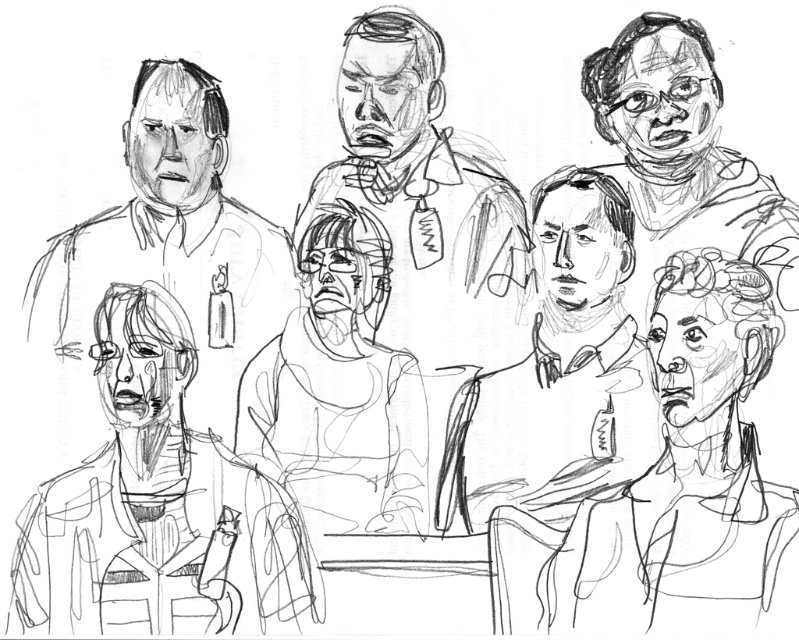
Between smooth paper man at center and matte black shirt at upper left, which one is positioned lower?

matte black shirt at upper left is below.

Which is behind, point (442, 298) or point (150, 208)?

The point (442, 298) is behind.

The height and width of the screenshot is (640, 799). I want to click on smooth paper man at center, so click(x=426, y=198).

Measure the distance between smooth paper man at center and smooth skin face at upper right.

They are 40.10 centimeters apart.

Is smooth paper man at center positioned at the back of smooth skin face at upper right?

Yes, it is.

At what (x,y) coordinates should I click in order to perform the action: click on smooth paper man at center. Please return your answer as a coordinate pair (x, y). The height and width of the screenshot is (640, 799). Looking at the image, I should click on (426, 198).

Is matte black shirt at upper left further to camera compared to smooth skin face at upper right?

Yes, matte black shirt at upper left is behind smooth skin face at upper right.

Which is in front, point (130, 109) or point (778, 289)?

Positioned in front is point (778, 289).

This screenshot has height=640, width=799. What do you see at coordinates (173, 243) in the screenshot?
I see `matte black shirt at upper left` at bounding box center [173, 243].

You are a GUI agent. You are given a task and a screenshot of the screen. Output one action in this format:
    pyautogui.click(x=<x>, y=<y>)
    Task: Click on the matte black shirt at upper left
    This screenshot has width=799, height=640.
    Given the screenshot: What is the action you would take?
    pyautogui.click(x=173, y=243)